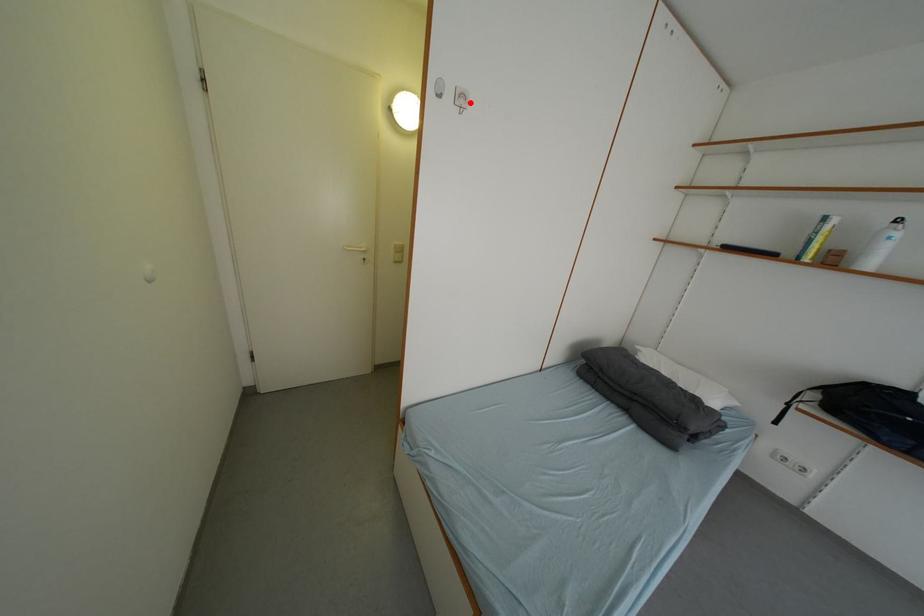
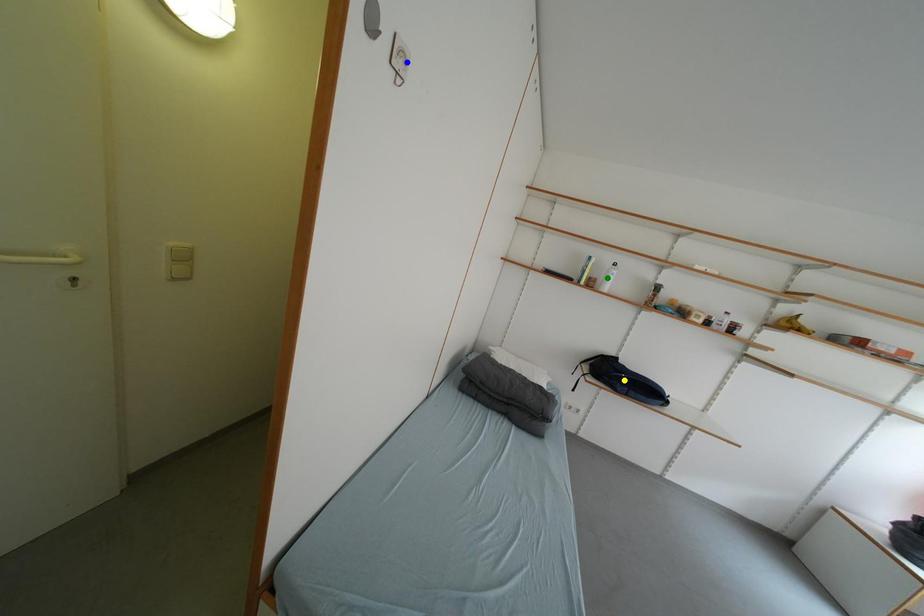
Question: I am providing you with two images of the same scene from different viewpoints. A red point is marked on the first image. You are given multiple points on the second image. Which point in image 2 is actually the same real-world point as the red point in image 1?

Choices:
 (A) yellow point
 (B) blue point
 (C) green point

Answer: (B)